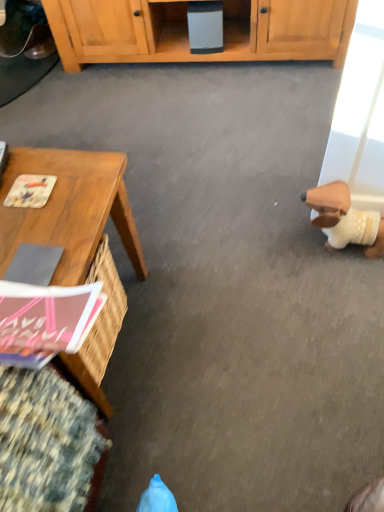
Where is `free space behind printed paper magazine at left, which appears as the 1th magazine when viewed from the top`? free space behind printed paper magazine at left, which appears as the 1th magazine when viewed from the top is located at coordinates (44, 162).